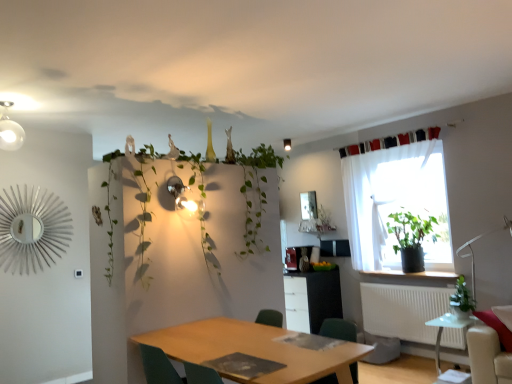
Identify the location of black fabric curtain at upper right. The image size is (512, 384). (390, 141).

What are the coordinates of `green leafy plant at upper center` in the screenshot? It's located at (255, 194).

Where is `matte white light fixture at upper center`? The width and height of the screenshot is (512, 384). matte white light fixture at upper center is located at coordinates (287, 144).

Looking at this image, which is correct: white plastic radiator at lower right is inside wooden table at center, the 1th table from the left, or outside of it?

The correct answer is: outside.

Is wooden table at center, the 2th table from the right, at the back of white plastic radiator at lower right?

No, wooden table at center, the 2th table from the right, is not at the back of white plastic radiator at lower right.

From the image's perspective, between white plastic radiator at lower right and wooden table at center, acting as the 1th table starting from the front, which one is located above?

From the image's view, wooden table at center, acting as the 1th table starting from the front, is above.

Does white plastic radiator at lower right have a greater height compared to wooden table at center, arranged as the 2th table when viewed from the back?

Yes, white plastic radiator at lower right is taller than wooden table at center, arranged as the 2th table when viewed from the back.

From the image's perspective, between transparent glass table at lower right, the 2th table when ordered from front to back, and white sheer curtain at upper right, who is located below?

transparent glass table at lower right, the 2th table when ordered from front to back, from the image's perspective.

Considering the positions of point (437, 324) and point (373, 203), is point (437, 324) closer or farther from the camera than point (373, 203)?

Clearly, point (437, 324) is closer to the camera than point (373, 203).

Looking at this image, is transparent glass table at lower right, the 1th table from the back, not within white sheer curtain at upper right?

That's correct, transparent glass table at lower right, the 1th table from the back, is outside of white sheer curtain at upper right.

Is transparent glass table at lower right, the 2th table when ordered from front to back, bigger or smaller than white sheer curtain at upper right?

transparent glass table at lower right, the 2th table when ordered from front to back, is smaller than white sheer curtain at upper right.

Is green fabric chair at lower center situated inside white glossy cabinet at center or outside?

green fabric chair at lower center is spatially situated outside white glossy cabinet at center.

From the picture: From the image's perspective, is green fabric chair at lower center located above or below white glossy cabinet at center?

green fabric chair at lower center is situated higher than white glossy cabinet at center in the image.

Where is `cabinetry below the green fabric chair at lower center (from a real-world perspective)`? This screenshot has height=384, width=512. cabinetry below the green fabric chair at lower center (from a real-world perspective) is located at coordinates (312, 299).

Which object is closer to the camera taking this photo, transparent glass table at lower right, acting as the 2th table starting from the left, or green fabric chair at lower center?

green fabric chair at lower center.

Locate an element on the screen. The image size is (512, 384). chair above the transparent glass table at lower right, the 1th table from the back (from the image's perspective) is located at coordinates (173, 369).

Is transparent glass table at lower right, the 2th table when ordered from front to back, not near green fabric chair at lower center?

Absolutely, transparent glass table at lower right, the 2th table when ordered from front to back, is distant from green fabric chair at lower center.

From the image's perspective, is transparent glass table at lower right, the 2th table when ordered from front to back, beneath green fabric chair at lower center?

Yes, from the image's perspective, transparent glass table at lower right, the 2th table when ordered from front to back, is below green fabric chair at lower center.

Considering the points (286, 304) and (392, 138), which point is in front, point (286, 304) or point (392, 138)?

The point (392, 138) is closer.

The width and height of the screenshot is (512, 384). I want to click on cabinetry below the black fabric curtain at upper right (from the image's perspective), so click(312, 299).

From a real-world perspective, is white glossy cabinet at center physically located above or below black fabric curtain at upper right?

In terms of real-world spatial position, white glossy cabinet at center is below black fabric curtain at upper right.

Can you confirm if white glossy cabinet at center is bigger than black fabric curtain at upper right?

Correct, white glossy cabinet at center is larger in size than black fabric curtain at upper right.

In terms of height, does black fabric curtain at upper right look taller or shorter compared to green leafy plant at upper center?

Clearly, black fabric curtain at upper right is shorter compared to green leafy plant at upper center.

In terms of width, does black fabric curtain at upper right look wider or thinner when compared to green leafy plant at upper center?

In the image, black fabric curtain at upper right appears to be more narrow than green leafy plant at upper center.

Is black fabric curtain at upper right to the left or to the right of green leafy plant at upper center in the image?

black fabric curtain at upper right is positioned on green leafy plant at upper center's right side.

Considering the sizes of black fabric curtain at upper right and green leafy plant at upper center in the image, is black fabric curtain at upper right bigger or smaller than green leafy plant at upper center?

black fabric curtain at upper right is smaller than green leafy plant at upper center.

Considering the sizes of objects wooden table at center, arranged as the 2th table when viewed from the back, and green leafy plant at upper center in the image provided, who is shorter, wooden table at center, arranged as the 2th table when viewed from the back, or green leafy plant at upper center?

wooden table at center, arranged as the 2th table when viewed from the back, is shorter.

From the image's perspective, which one is positioned higher, wooden table at center, arranged as the 2th table when viewed from the back, or green leafy plant at upper center?

green leafy plant at upper center, from the image's perspective.

Based on the photo, is green leafy plant at upper center a part of wooden table at center, arranged as the 2th table when viewed from the back?

No, green leafy plant at upper center is not surrounded by wooden table at center, arranged as the 2th table when viewed from the back.

Can you tell me how much wooden table at center, acting as the 1th table starting from the front, and green leafy plant at upper center differ in facing direction?

wooden table at center, acting as the 1th table starting from the front, and green leafy plant at upper center are facing 89.9 degrees away from each other.

Find the location of a particular element. table located above the white plastic radiator at lower right (from a real-world perspective) is located at coordinates (257, 350).

Where is `window that is above the transparent glass table at lower right, acting as the 2th table starting from the left (from the image's perspective)`? The height and width of the screenshot is (384, 512). window that is above the transparent glass table at lower right, acting as the 2th table starting from the left (from the image's perspective) is located at coordinates (396, 204).

Looking at the image, which one is located closer to green matte plant at window, marked as the first houseplant in a back-to-front arrangement, white glossy cabinet at center or green fabric chair at lower center?

white glossy cabinet at center is positioned closer to the anchor green matte plant at window, marked as the first houseplant in a back-to-front arrangement.

From the image, which object appears to be nearer to green leafy plant at upper center, white plastic radiator at lower right or glossy silver mirror at center?

glossy silver mirror at center is positioned closer to the anchor green leafy plant at upper center.

Which object lies nearer to the anchor point white glossy cabinet at center, matte white light fixture at upper center or green fabric chair at lower center?

Among the two, matte white light fixture at upper center is located nearer to white glossy cabinet at center.

When comparing their distances from white glossy cabinet at center, does black fabric curtain at upper right or green leafy plant at right, arranged as the second houseplant when viewed from the back, seem further?

green leafy plant at right, arranged as the second houseplant when viewed from the back, lies further to white glossy cabinet at center than the other object.

Which object lies nearer to the anchor point green matte plant at window, which is counted as the 2th houseplant, starting from the front, matte white light fixture at upper center or glossy silver mirror at center?

glossy silver mirror at center lies closer to green matte plant at window, which is counted as the 2th houseplant, starting from the front, than the other object.

Estimate the real-world distances between objects in this image. Which object is closer to green leafy plant at right, the 1th houseplant viewed from the front, green fabric chair at lower center or black fabric curtain at upper right?

black fabric curtain at upper right is positioned closer to the anchor green leafy plant at right, the 1th houseplant viewed from the front.

Considering their positions, is white glossy cabinet at center positioned further to white plastic radiator at lower right than green matte plant at window, which is counted as the 2th houseplant, starting from the front?

Based on the image, white glossy cabinet at center appears to be further to white plastic radiator at lower right.

Looking at the image, which one is located closer to white glossy cabinet at center, green leafy plant at upper center or green leafy plant at right, arranged as the second houseplant when viewed from the back?

Based on the image, green leafy plant at upper center appears to be nearer to white glossy cabinet at center.

At what (x,y) coordinates should I click in order to perform the action: click on table located between wooden table at center, the 1th table from the left, and white glossy cabinet at center in the depth direction. Please return your answer as a coordinate pair (x, y). The height and width of the screenshot is (384, 512). Looking at the image, I should click on (448, 327).

Find the location of a particular element. The image size is (512, 384). table between green leafy plant at upper center and black fabric curtain at upper right from left to right is located at coordinates (257, 350).

Identify the location of curtain located between green leafy plant at upper center and matte white light fixture at upper center in the depth direction. (390, 141).

Locate an element on the screen. Image resolution: width=512 pixels, height=384 pixels. radiator positioned between green fabric chair at lower center and white glossy cabinet at center from near to far is located at coordinates (408, 313).